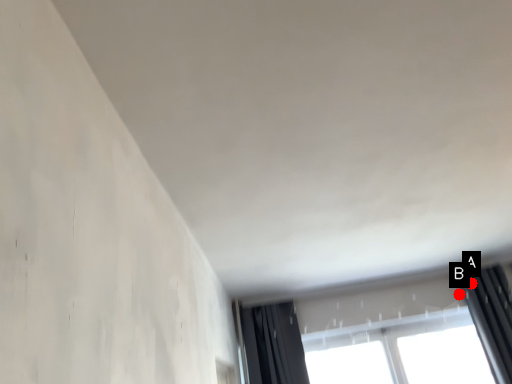
Question: Two points are circled on the image, labeled by A and B beside each circle. Which point is further to the camera?

Choices:
 (A) A is further
 (B) B is further

Answer: (B)